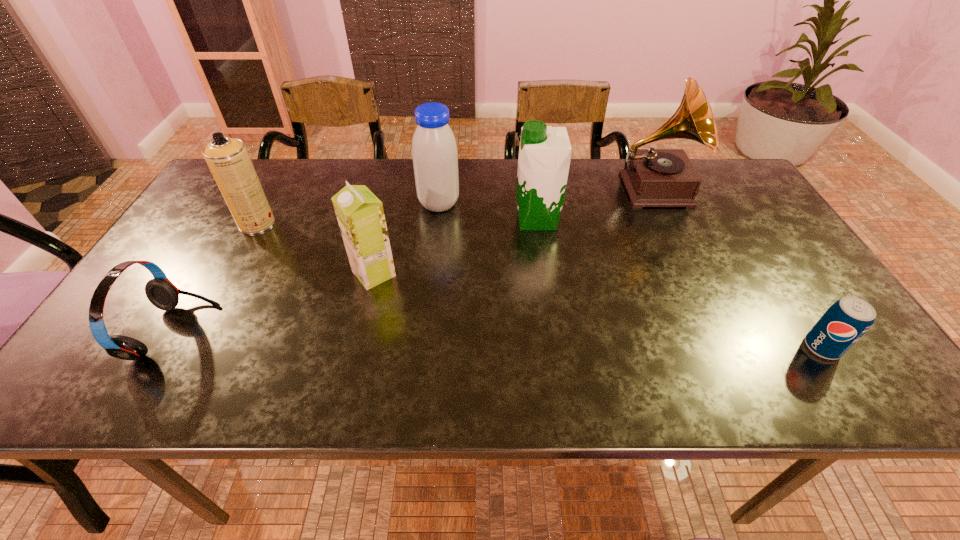
Identify the location of the tallest object. (652, 177).

Locate an element on the screen. phonograph record is located at coordinates (652, 177).

Locate an element on the screen. This screenshot has height=540, width=960. the fourth object from left to right is located at coordinates (434, 150).

Identify the location of the third object from right to left. (544, 158).

Locate an element on the screen. This screenshot has width=960, height=540. aerosol can is located at coordinates (227, 158).

Where is `the leftmost soya milk`? the leftmost soya milk is located at coordinates pos(360,214).

Locate an element on the screen. The width and height of the screenshot is (960, 540). the third object from left to right is located at coordinates (360, 214).

Locate an element on the screen. This screenshot has width=960, height=540. the sixth tallest object is located at coordinates (161, 292).

Image resolution: width=960 pixels, height=540 pixels. I want to click on the rightmost object, so click(848, 319).

Where is `pop`? This screenshot has height=540, width=960. pop is located at coordinates (848, 319).